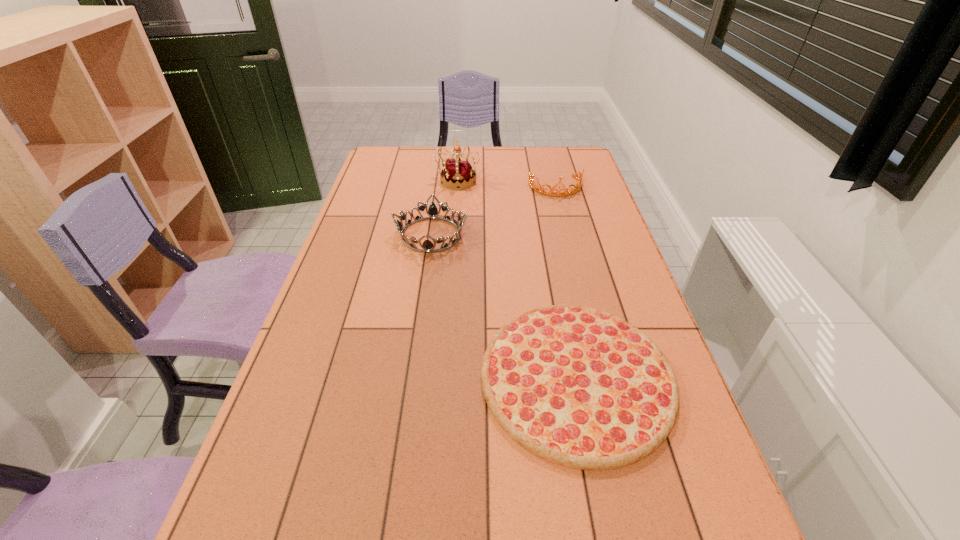
Find the location of a particular element. free space between the tallest object and the shortest object is located at coordinates (517, 279).

Identify the location of vacant area that lies between the tallest object and the rightmost tiara. The width and height of the screenshot is (960, 540). (507, 184).

At what (x,y) coordinates should I click in order to perform the action: click on vacant area that lies between the tallest object and the pizza. Please return your answer as a coordinate pair (x, y). This screenshot has height=540, width=960. Looking at the image, I should click on (517, 279).

I want to click on vacant area that lies between the rightmost tiara and the pizza, so click(x=566, y=282).

Identify the location of vacant region between the shortest object and the third farthest object. (504, 306).

Locate an element on the screen. The image size is (960, 540). object that is the second closest to the tallest object is located at coordinates (542, 190).

You are a GUI agent. You are given a task and a screenshot of the screen. Output one action in this format:
    pyautogui.click(x=<x>, y=<y>)
    Task: Click on the object that can be found as the closest to the rightmost tiara
    The height and width of the screenshot is (540, 960).
    Given the screenshot: What is the action you would take?
    pyautogui.click(x=458, y=173)

Locate an element on the screen. the closest tiara to the tallest tiara is located at coordinates (432, 212).

Locate an element on the screen. The height and width of the screenshot is (540, 960). tiara that stands as the closest to the nearest tiara is located at coordinates pyautogui.click(x=458, y=173).

Where is `free location that satisfies the following two spatial constraints: 1. on the front-facing side of the pizza; 2. on the left side of the nearest tiara`? free location that satisfies the following two spatial constraints: 1. on the front-facing side of the pizza; 2. on the left side of the nearest tiara is located at coordinates (411, 377).